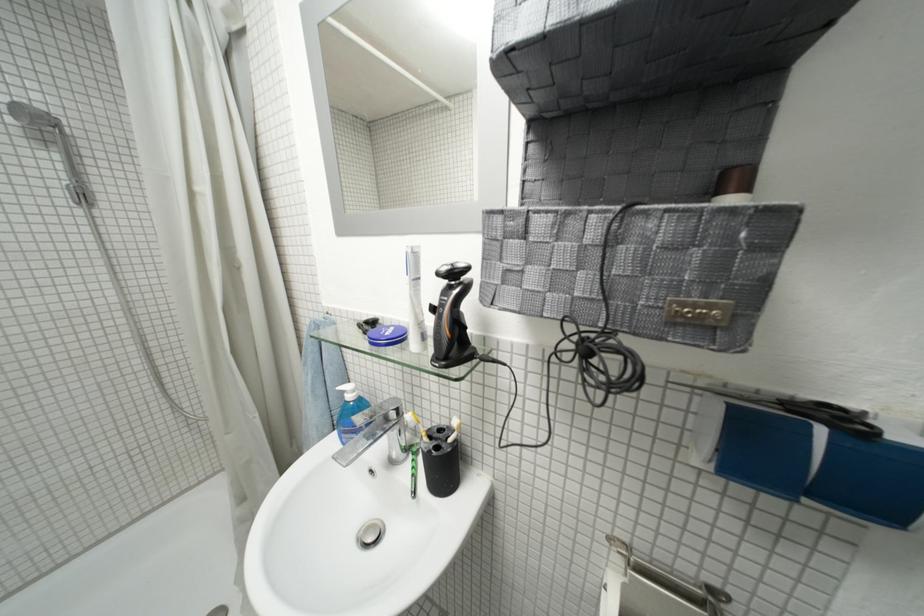
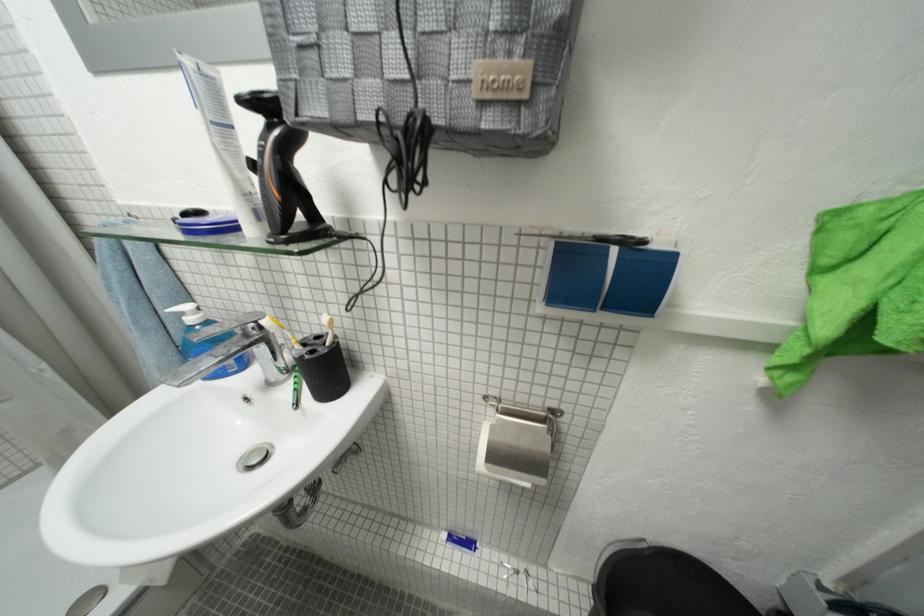
The point at (415,458) is marked in the first image. Where is the corresponding point in the second image?

(296, 378)